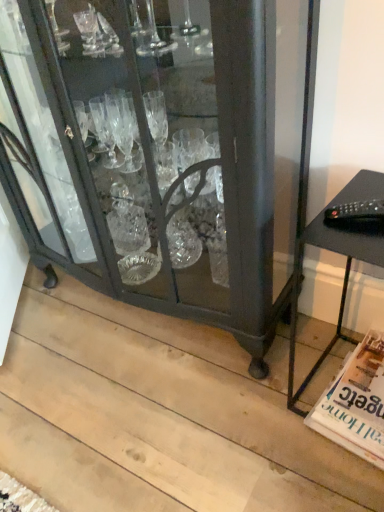
Question: Based on their positions, is white glossy magazine at lower right located to the left or right of black matte table at right?

Choices:
 (A) right
 (B) left

Answer: (A)

Question: Looking at their shapes, would you say white glossy magazine at lower right is wider or thinner than black matte table at right?

Choices:
 (A) thin
 (B) wide

Answer: (B)

Question: Which of these objects is positioned closest to the black matte table at right?

Choices:
 (A) matte black cabinet at center
 (B) white glossy magazine at lower right

Answer: (B)

Question: Considering the real-world distances, which object is farthest from the white glossy magazine at lower right?

Choices:
 (A) matte black cabinet at center
 (B) black matte table at right

Answer: (A)